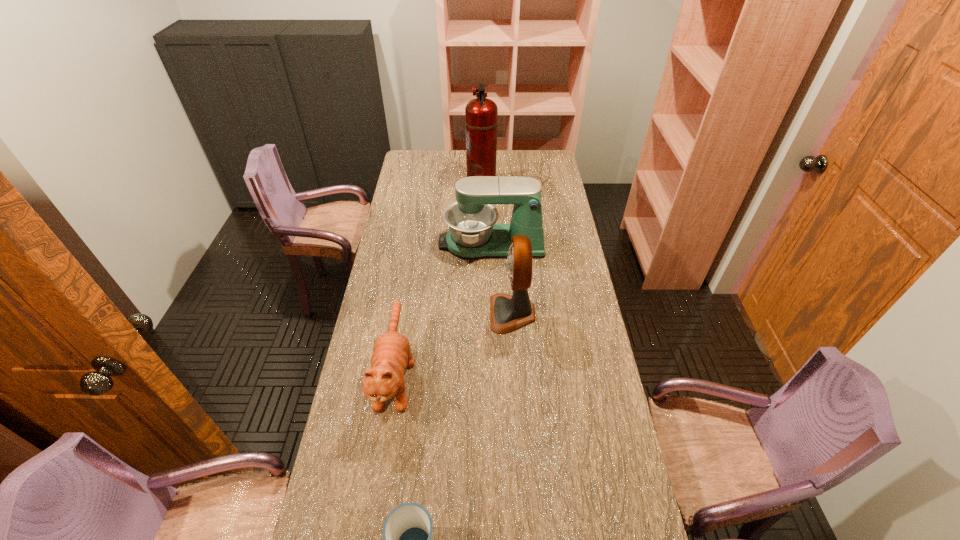
At what (x,y) coordinates should I click in order to perform the action: click on vacant space at the left edge of the desktop. Please return your answer as a coordinate pair (x, y). The width and height of the screenshot is (960, 540). Looking at the image, I should click on (381, 415).

I want to click on free space at the right edge of the desktop, so click(570, 392).

This screenshot has height=540, width=960. In order to click on free space at the far right corner of the desktop in this screenshot , I will do `click(557, 165)`.

Where is `free spot between the fourth tallest object and the farthest object`? The image size is (960, 540). free spot between the fourth tallest object and the farthest object is located at coordinates (439, 279).

This screenshot has width=960, height=540. In order to click on empty location between the fourth tallest object and the mixer in this screenshot , I will do `click(444, 308)`.

The width and height of the screenshot is (960, 540). In order to click on empty space between the fan and the fourth nearest object in this screenshot , I will do `click(502, 278)`.

The height and width of the screenshot is (540, 960). What are the coordinates of `the fourth closest object to the fan` in the screenshot? It's located at (481, 114).

Find the location of a particular element. object that is the fourth closest to the fourth nearest object is located at coordinates (407, 532).

Where is `vacant region that satisfies the following two spatial constraints: 1. on the front-facing side of the third shortest object; 2. on the face of the cat`? The height and width of the screenshot is (540, 960). vacant region that satisfies the following two spatial constraints: 1. on the front-facing side of the third shortest object; 2. on the face of the cat is located at coordinates (494, 373).

The image size is (960, 540). I want to click on free space that satisfies the following two spatial constraints: 1. on the front-facing side of the fourth nearest object; 2. on the face of the cat, so click(x=494, y=373).